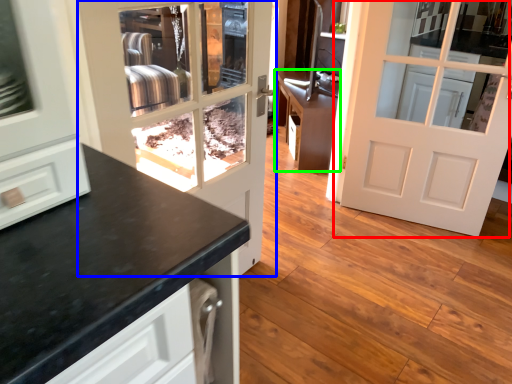
Question: Which object is the closest to the door (highlighted by a red box)? Choose among these: door (highlighted by a blue box) or cabinetry (highlighted by a green box).

Choices:
 (A) door
 (B) cabinetry

Answer: (B)